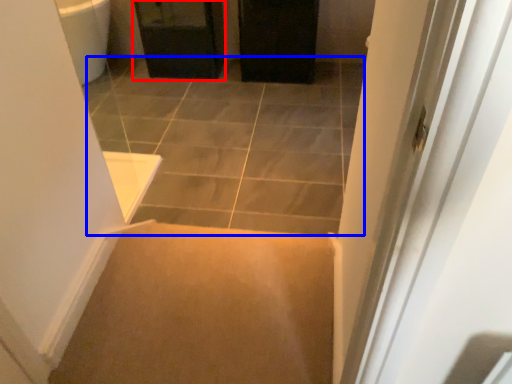
Question: Among these objects, which one is farthest to the camera, cabinetry (highlighted by a red box) or path (highlighted by a blue box)?

Choices:
 (A) cabinetry
 (B) path

Answer: (A)